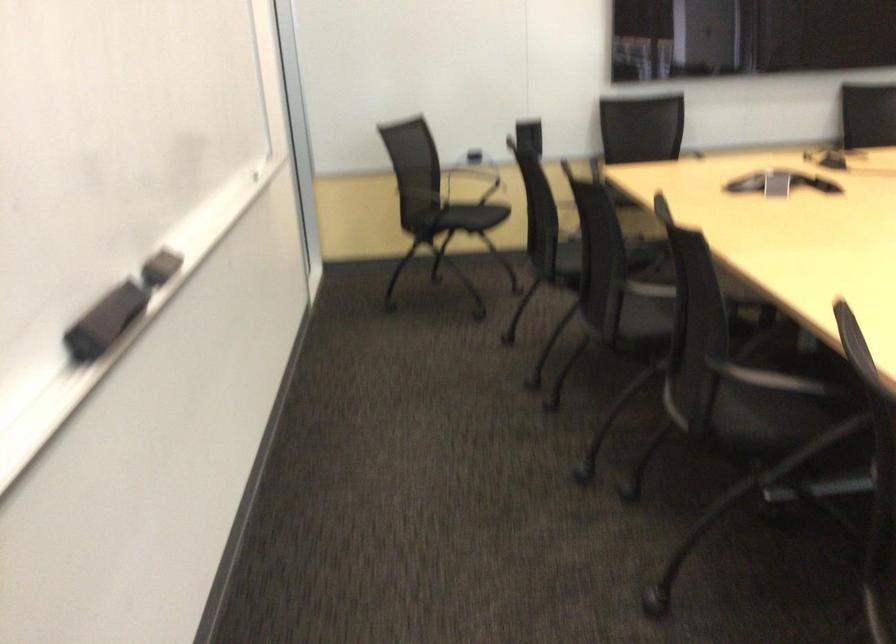
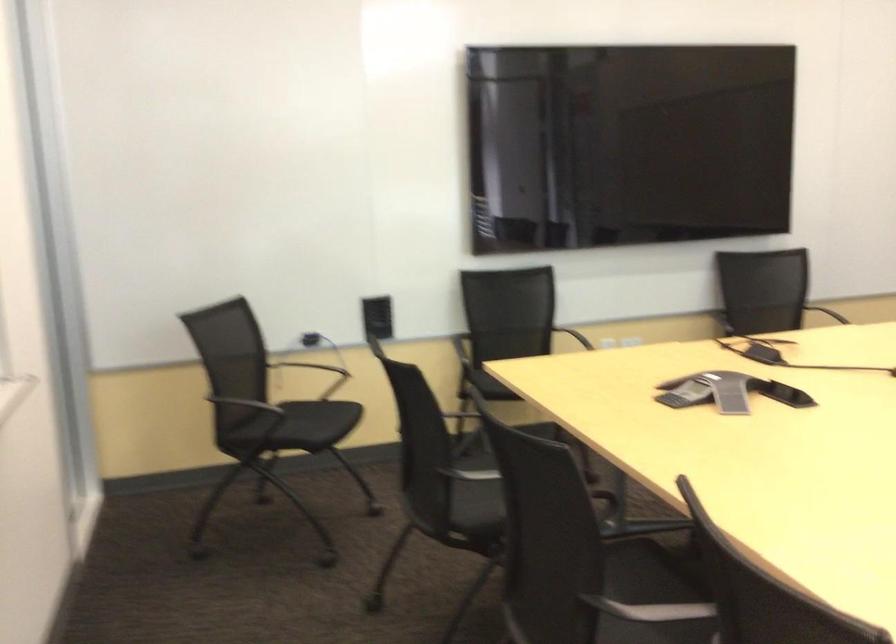
Question: The first image is from the beginning of the video and the second image is from the end. How did the camera likely rotate when shooting the video?

Choices:
 (A) Left
 (B) Right
 (C) Up
 (D) Down

Answer: (B)